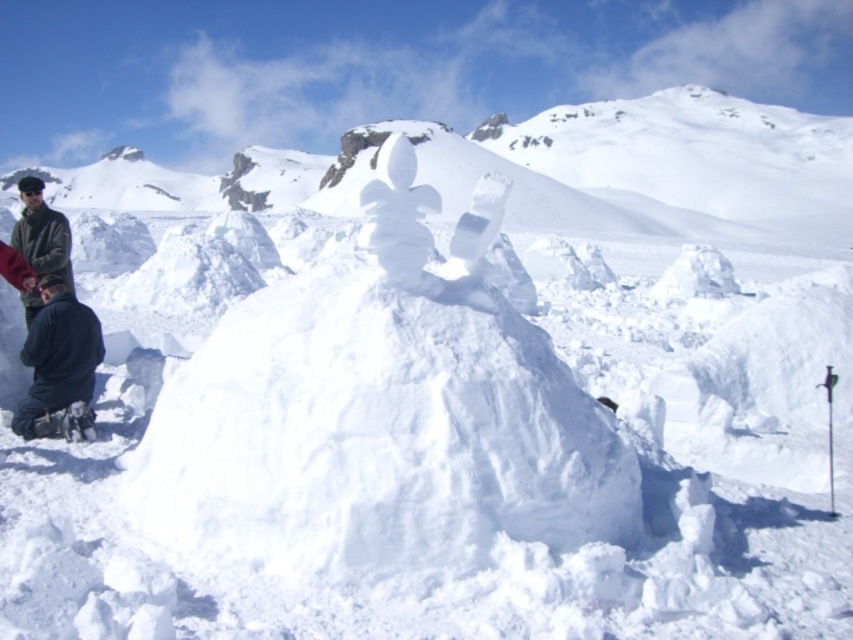
Question: Which point is farther to the camera?

Choices:
 (A) dark gray jacket at left
 (B) dark blue fleece at lower left

Answer: (A)

Question: Which point is closer to the camera taking this photo?

Choices:
 (A) (44, 257)
 (B) (427, 211)
 (C) (20, 432)

Answer: (B)

Question: Does dark blue fleece at lower left lie in front of dark gray jacket at left?

Choices:
 (A) no
 (B) yes

Answer: (B)

Question: Which object appears closest to the camera in this image?

Choices:
 (A) dark blue fleece at lower left
 (B) dark gray jacket at left
 (C) white fluffy snowman at center

Answer: (C)

Question: Can you confirm if white fluffy snowman at center is positioned to the right of dark gray jacket at left?

Choices:
 (A) no
 (B) yes

Answer: (B)

Question: Can you confirm if dark blue fleece at lower left is positioned above dark gray jacket at left?

Choices:
 (A) yes
 (B) no

Answer: (B)